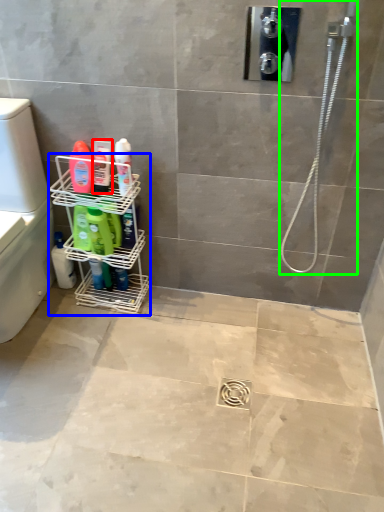
Question: Based on their relative distances, which object is nearer to toiletry (highlighted by a red box)? Choose from shelf (highlighted by a blue box) and shower (highlighted by a green box).

Choices:
 (A) shelf
 (B) shower

Answer: (A)